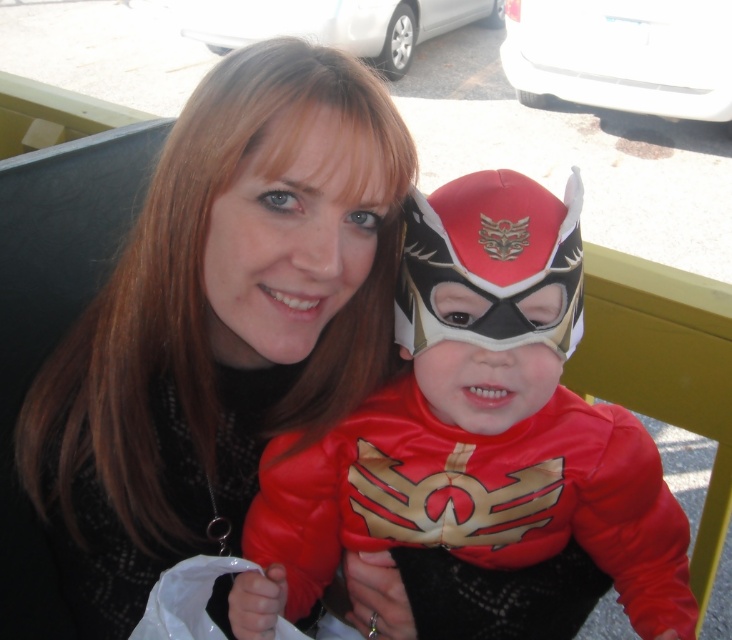
Question: Can you confirm if matte black hair at upper center is wider than shiny red costume at center?

Choices:
 (A) no
 (B) yes

Answer: (A)

Question: Which point is farther to the camera?

Choices:
 (A) pyautogui.click(x=397, y=518)
 (B) pyautogui.click(x=153, y=204)

Answer: (A)

Question: Considering the relative positions of matte black hair at upper center and shiny red costume at center in the image provided, where is matte black hair at upper center located with respect to shiny red costume at center?

Choices:
 (A) left
 (B) right

Answer: (A)

Question: Among these objects, which one is farthest from the camera?

Choices:
 (A) shiny red costume at center
 (B) matte black hair at upper center

Answer: (A)

Question: Is matte black hair at upper center bigger than shiny red costume at center?

Choices:
 (A) yes
 (B) no

Answer: (A)